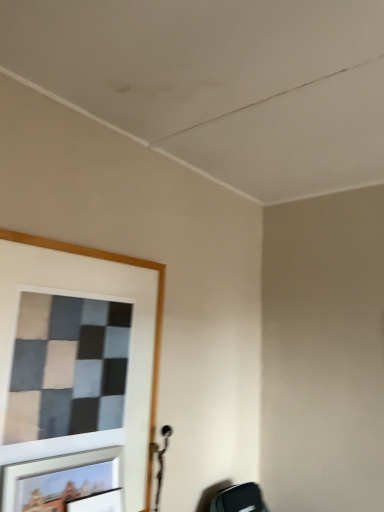
Question: Is point [x=69, y=499] closer or farther from the camera than point [x=66, y=508]?

Choices:
 (A) closer
 (B) farther

Answer: (B)

Question: Based on their sizes in the image, would you say metallic silver picture frame at lower left, marked as the 1th picture frame in a top-to-bottom arrangement, is bigger or smaller than matte black picture frame at lower left, which is counted as the 1th picture frame, starting from the bottom?

Choices:
 (A) small
 (B) big

Answer: (B)

Question: From the image's perspective, relative to matte black picture frame at lower left, which is the second picture frame in top-to-bottom order, is metallic silver picture frame at lower left, which is the second picture frame in bottom-to-top order, above or below?

Choices:
 (A) above
 (B) below

Answer: (A)

Question: From their relative heights in the image, would you say matte black picture frame at lower left, which is counted as the 1th picture frame, starting from the bottom, is taller or shorter than metallic silver picture frame at lower left, marked as the 1th picture frame in a top-to-bottom arrangement?

Choices:
 (A) short
 (B) tall

Answer: (A)

Question: From a real-world perspective, relative to metallic silver picture frame at lower left, which is the second picture frame in bottom-to-top order, is matte black picture frame at lower left, which is the second picture frame in top-to-bottom order, vertically above or below?

Choices:
 (A) below
 (B) above

Answer: (A)

Question: Would you say matte black picture frame at lower left, which is counted as the 1th picture frame, starting from the bottom, is to the left or to the right of metallic silver picture frame at lower left, marked as the 1th picture frame in a top-to-bottom arrangement, in the picture?

Choices:
 (A) left
 (B) right

Answer: (B)

Question: Does point (104, 505) appear closer or farther from the camera than point (112, 463)?

Choices:
 (A) closer
 (B) farther

Answer: (A)